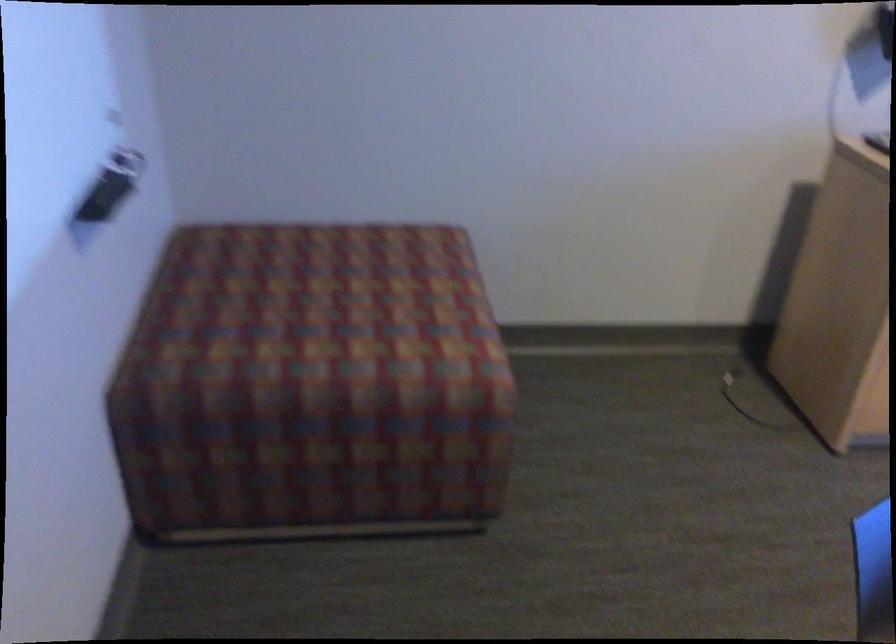
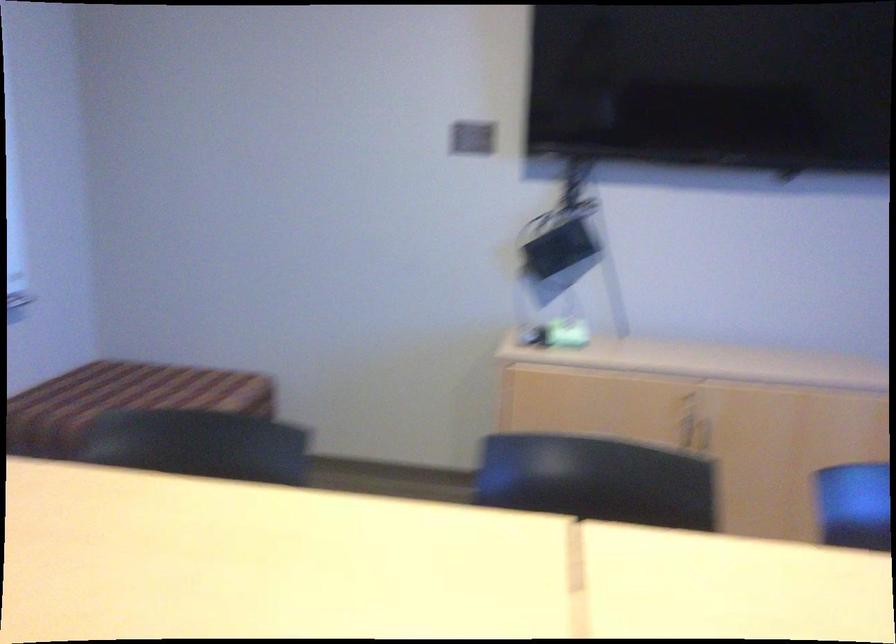
The images are taken continuously from a first-person perspective. In which direction are you moving?

The cameraman walked toward right, backward.